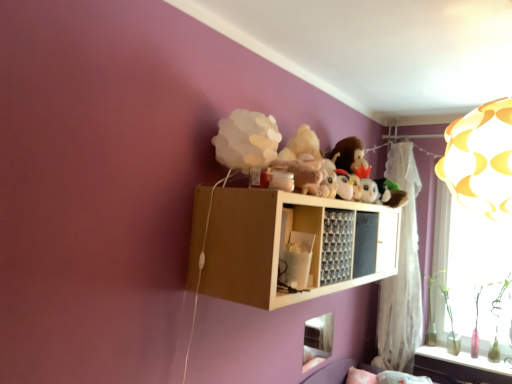
In order to face white sheer curtain at upper right, should I rotate leftwards or rightwards?

To align with it, rotate right about 18.993°.

Where is `white paper lampshade at upper center, the 2th toy viewed from the right`? This screenshot has height=384, width=512. white paper lampshade at upper center, the 2th toy viewed from the right is located at coordinates (247, 140).

The height and width of the screenshot is (384, 512). What do you see at coordinates (343, 185) in the screenshot? I see `white plush penguin at center, placed as the second toy when sorted from front to back` at bounding box center [343, 185].

Identify the location of clear glass bottles at lower right. (462, 365).

Consider the image. In order to face transparent plastic at right, should I rotate leftwards or rightwards?

To face it directly, rotate right by 27.066 degrees.

This screenshot has height=384, width=512. Identify the location of white sheer curtain at upper right. (401, 274).

Can you see transparent plastic at right touching white plush penguin at center, the first toy when ordered from right to left?

No, transparent plastic at right is not making contact with white plush penguin at center, the first toy when ordered from right to left.

Considering the points (443, 265) and (339, 191), which point is behind, point (443, 265) or point (339, 191)?

Point (443, 265)

From a real-world perspective, between transparent plastic at right and white plush penguin at center, placed as the second toy when sorted from front to back, who is vertically higher?

white plush penguin at center, placed as the second toy when sorted from front to back.

Between transparent plastic at right and white plush penguin at center, placed as the first toy when sorted from back to front, which one has larger width?

With larger width is white plush penguin at center, placed as the first toy when sorted from back to front.

From a real-world perspective, is white paper lampshade at upper center, the 2th toy viewed from the right, positioned above or below transparent plastic at right?

In terms of real-world spatial position, white paper lampshade at upper center, the 2th toy viewed from the right, is above transparent plastic at right.

Can you confirm if white paper lampshade at upper center, the 2th toy viewed from the right, is bigger than transparent plastic at right?

No, white paper lampshade at upper center, the 2th toy viewed from the right, is not bigger than transparent plastic at right.

Is white paper lampshade at upper center, the 2th toy viewed from the right, inside or outside of transparent plastic at right?

white paper lampshade at upper center, the 2th toy viewed from the right, is spatially situated outside transparent plastic at right.

Can you confirm if white paper lampshade at upper center, acting as the 1th toy starting from the left, is positioned to the left of transparent plastic at right?

Yes, white paper lampshade at upper center, acting as the 1th toy starting from the left, is to the left of transparent plastic at right.

Is white plush penguin at center, the first toy when ordered from right to left, positioned with its back to transparent plastic at right?

No, white plush penguin at center, the first toy when ordered from right to left, is not facing the opposite direction of transparent plastic at right.

Where is `the 1st toy to the left of the transparent plastic at right, starting your count from the anchor`? the 1st toy to the left of the transparent plastic at right, starting your count from the anchor is located at coordinates (343, 185).

Is white plush penguin at center, placed as the second toy when sorted from front to back, wider or thinner than transparent plastic at right?

Clearly, white plush penguin at center, placed as the second toy when sorted from front to back, has more width compared to transparent plastic at right.

Is white paper lampshade at upper center, acting as the 2th toy starting from the back, to the left of clear glass bottles at lower right from the viewer's perspective?

Indeed, white paper lampshade at upper center, acting as the 2th toy starting from the back, is positioned on the left side of clear glass bottles at lower right.

Considering the sizes of objects white paper lampshade at upper center, the 2th toy viewed from the right, and clear glass bottles at lower right in the image provided, who is wider, white paper lampshade at upper center, the 2th toy viewed from the right, or clear glass bottles at lower right?

clear glass bottles at lower right is wider.

Is white paper lampshade at upper center, acting as the 1th toy starting from the left, situated inside clear glass bottles at lower right or outside?

white paper lampshade at upper center, acting as the 1th toy starting from the left, is not enclosed by clear glass bottles at lower right.

Which point is more distant from viewer, (224, 153) or (466, 372)?

The point (466, 372) is more distant.

From a real-world perspective, is white sheer curtain at upper right physically below white paper lampshade at upper center, acting as the 1th toy starting from the left?

Correct, in the physical world, white sheer curtain at upper right is lower than white paper lampshade at upper center, acting as the 1th toy starting from the left.

Which of these two, white sheer curtain at upper right or white paper lampshade at upper center, acting as the 2th toy starting from the back, is bigger?

white sheer curtain at upper right is bigger.

Does white sheer curtain at upper right contain white paper lampshade at upper center, acting as the 1th toy starting from the left?

No, white sheer curtain at upper right does not contain white paper lampshade at upper center, acting as the 1th toy starting from the left.

This screenshot has height=384, width=512. Identify the location of curtain that appears on the right of white paper lampshade at upper center, acting as the 1th toy starting from the left. (401, 274).

Between clear glass bottles at lower right and white sheer curtain at upper right, which one has larger width?

With larger width is clear glass bottles at lower right.

From the image's perspective, does clear glass bottles at lower right appear lower than white sheer curtain at upper right?

Yes, from the image's perspective, clear glass bottles at lower right is beneath white sheer curtain at upper right.

Considering the positions of objects clear glass bottles at lower right and white sheer curtain at upper right in the image provided, who is more to the left, clear glass bottles at lower right or white sheer curtain at upper right?

white sheer curtain at upper right.

From the picture: Is white sheer curtain at upper right at the back of clear glass bottles at lower right?

No, clear glass bottles at lower right's orientation is not away from white sheer curtain at upper right.

Consider the image. Which object is positioned more to the right, transparent plastic at right or white sheer curtain at upper right?

Positioned to the right is transparent plastic at right.

Based on the photo, considering the relative sizes of transparent plastic at right and white sheer curtain at upper right in the image provided, is transparent plastic at right wider than white sheer curtain at upper right?

No.

Is transparent plastic at right looking in the opposite direction of white sheer curtain at upper right?

No, transparent plastic at right is not facing away from white sheer curtain at upper right.

From the image's perspective, is transparent plastic at right located above or below white sheer curtain at upper right?

From the image's perspective, transparent plastic at right appears below white sheer curtain at upper right.

You are a GUI agent. You are given a task and a screenshot of the screen. Output one action in this format:
    pyautogui.click(x=<x>, y=<y>)
    Task: Click on the window screen to the right of white plush penguin at center, placed as the first toy when sorted from back to front
    Image resolution: width=512 pixels, height=384 pixels.
    Given the screenshot: What is the action you would take?
    pyautogui.click(x=470, y=261)

Image resolution: width=512 pixels, height=384 pixels. I want to click on window screen below the white paper lampshade at upper center, the first toy viewed from the front (from the image's perspective), so (470, 261).

Considering their positions, is white plush penguin at center, placed as the first toy when sorted from back to front, positioned closer to white paper lampshade at upper center, the 2th toy viewed from the right, than transparent plastic at right?

The object closer to white paper lampshade at upper center, the 2th toy viewed from the right, is white plush penguin at center, placed as the first toy when sorted from back to front.

Considering their positions, is white sheer curtain at upper right positioned further to wooden shelf at upper center than transparent plastic at right?

Among the two, white sheer curtain at upper right is located further to wooden shelf at upper center.

Estimate the real-world distances between objects in this image. Which object is further from white sheer curtain at upper right, white plush penguin at center, placed as the second toy when sorted from front to back, or transparent plastic at right?

white plush penguin at center, placed as the second toy when sorted from front to back, is further to white sheer curtain at upper right.

Considering their positions, is white plush penguin at center, placed as the first toy when sorted from back to front, positioned further to white sheer curtain at upper right than wooden shelf at upper center?

Based on the image, white plush penguin at center, placed as the first toy when sorted from back to front, appears to be further to white sheer curtain at upper right.

Estimate the real-world distances between objects in this image. Which object is further from transparent plastic at right, clear glass bottles at lower right or white paper lampshade at upper center, the 2th toy viewed from the right?

Among the two, white paper lampshade at upper center, the 2th toy viewed from the right, is located further to transparent plastic at right.

Which object lies further to the anchor point white sheer curtain at upper right, clear glass bottles at lower right or wooden shelf at upper center?

wooden shelf at upper center is positioned further to the anchor white sheer curtain at upper right.

Considering their positions, is clear glass bottles at lower right positioned closer to transparent plastic at right than white sheer curtain at upper right?

Among the two, white sheer curtain at upper right is located nearer to transparent plastic at right.

Considering their positions, is white paper lampshade at upper center, acting as the 2th toy starting from the back, positioned closer to clear glass bottles at lower right than wooden shelf at upper center?

Among the two, wooden shelf at upper center is located nearer to clear glass bottles at lower right.

I want to click on window sill between white plush penguin at center, the first toy when ordered from right to left, and transparent plastic at right from left to right, so click(462, 365).

At what (x,y) coordinates should I click in order to perform the action: click on window sill between white paper lampshade at upper center, the 2th toy viewed from the right, and transparent plastic at right. Please return your answer as a coordinate pair (x, y). The width and height of the screenshot is (512, 384). Looking at the image, I should click on (462, 365).

You are a GUI agent. You are given a task and a screenshot of the screen. Output one action in this format:
    pyautogui.click(x=<x>, y=<y>)
    Task: Click on the window sill between wooden shelf at upper center and white sheer curtain at upper right from front to back
    This screenshot has height=384, width=512.
    Given the screenshot: What is the action you would take?
    click(x=462, y=365)

Where is `curtain between white paper lampshade at upper center, the 2th toy viewed from the right, and transparent plastic at right from left to right`? The image size is (512, 384). curtain between white paper lampshade at upper center, the 2th toy viewed from the right, and transparent plastic at right from left to right is located at coordinates (401, 274).